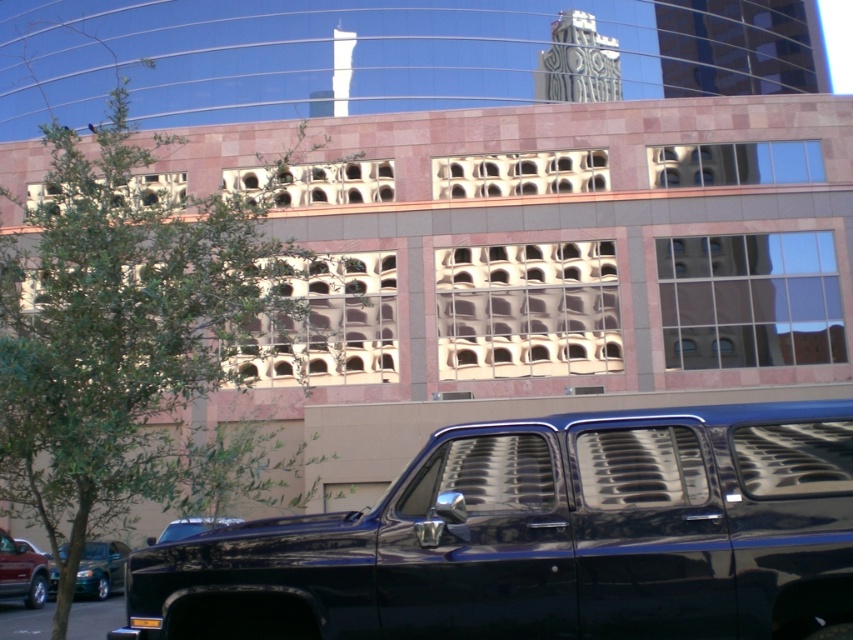
You are a delivery person trying to park your delivery van between the metallic green sedan at lower left and the shiny black truck at lower center. Is there enough space between them to fit your van, which is 6 meters long?

The metallic green sedan at lower left is positioned over shiny black truck at lower center, meaning they are parked directly next to each other with no space in between. Therefore, there is no space to fit the delivery van between them.

You are a delivery person trying to park your delivery van between the metallic red suv at lower left and the shiny black truck at lower center. Can you fit your van, which is 5 meters long, in the available space between them?

The metallic red suv at lower left is smaller than the shiny black truck at lower center, but the exact distance between them isn